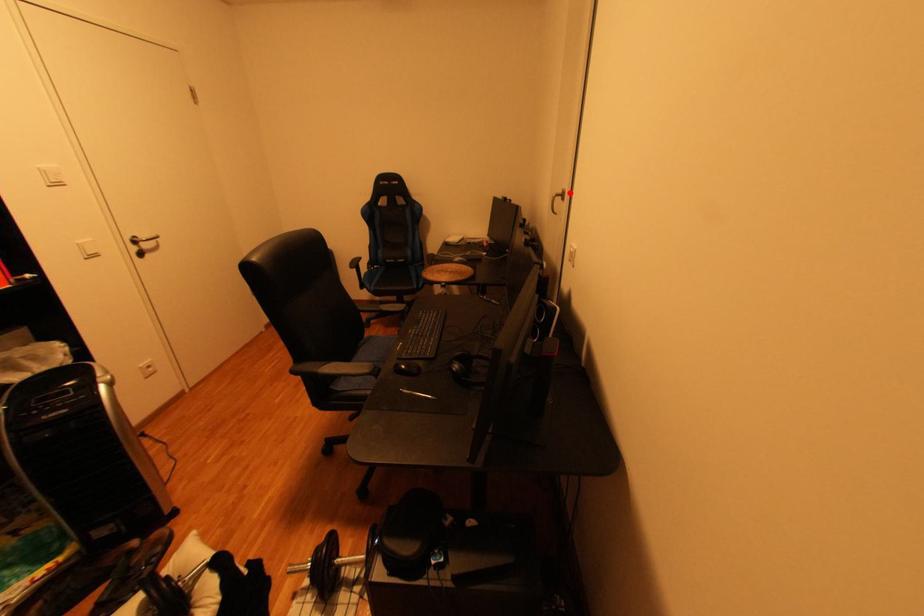
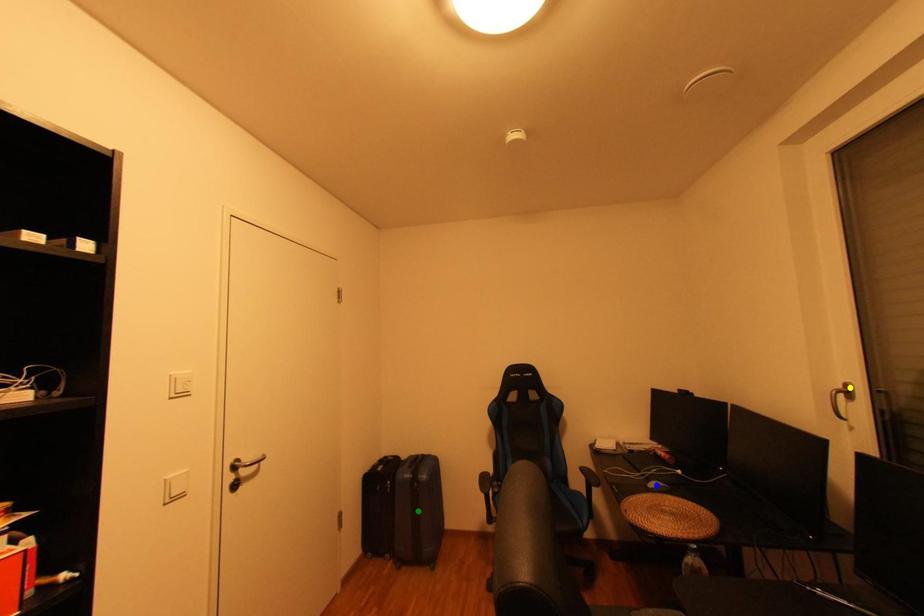
Question: I am providing you with two images of the same scene from different viewpoints. A red point is marked on the first image. You are given multiple points on the second image. Which point in image 2 represents the same 3d spot as the red point in image 1?

Choices:
 (A) green point
 (B) blue point
 (C) yellow point

Answer: (C)